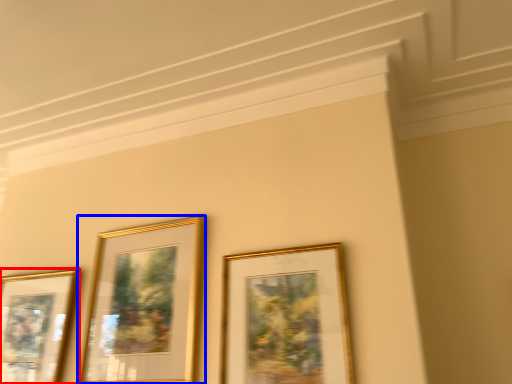
Question: Among these objects, which one is nearest to the camera, picture frame (highlighted by a red box) or picture frame (highlighted by a blue box)?

Choices:
 (A) picture frame
 (B) picture frame

Answer: (B)